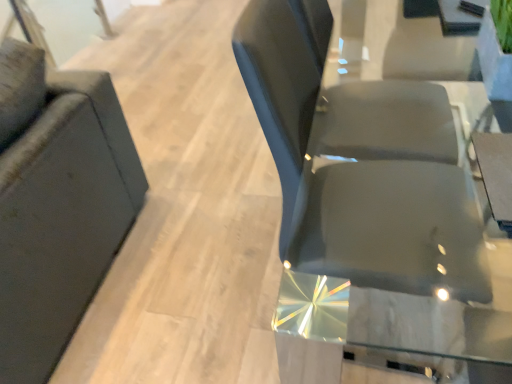
This screenshot has width=512, height=384. What are the coordinates of `vacant space to the right of transparent glass door at upper left` in the screenshot? It's located at (144, 50).